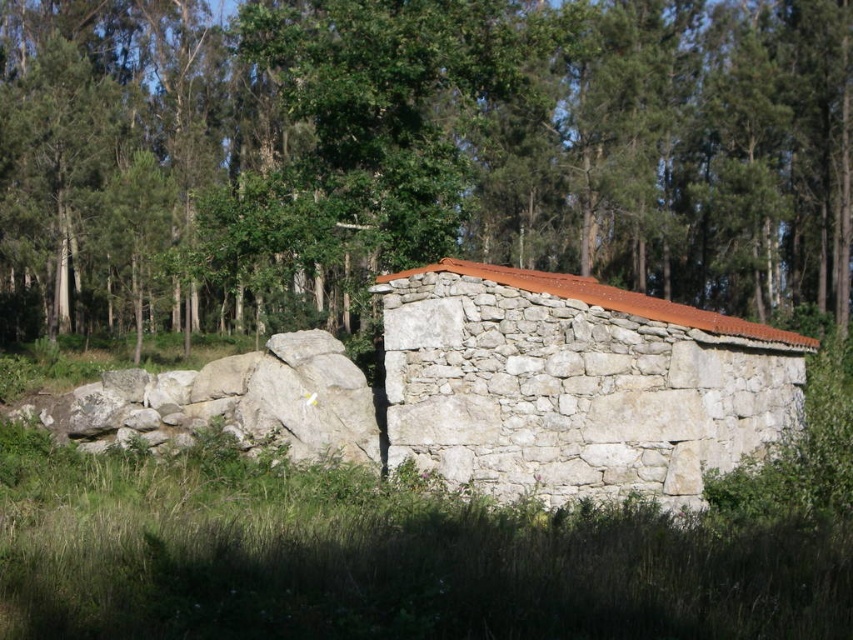
Question: Which of the following is the farthest from the observer?

Choices:
 (A) (77, 467)
 (B) (57, 92)

Answer: (B)

Question: Which point is closer to the camera?

Choices:
 (A) green grass at lower center
 (B) green leafy tree at center
 (C) white stone hut at center

Answer: (A)

Question: Is green leafy tree at center positioned at the back of green grass at lower center?

Choices:
 (A) yes
 (B) no

Answer: (A)

Question: Where is green grass at lower center located in relation to white stone hut at center in the image?

Choices:
 (A) above
 (B) below

Answer: (A)

Question: Considering the real-world distances, which object is farthest from the green leafy tree at center?

Choices:
 (A) white stone hut at center
 (B) green grass at lower center

Answer: (A)

Question: Does green leafy tree at center appear on the left side of green grass at lower center?

Choices:
 (A) no
 (B) yes

Answer: (A)